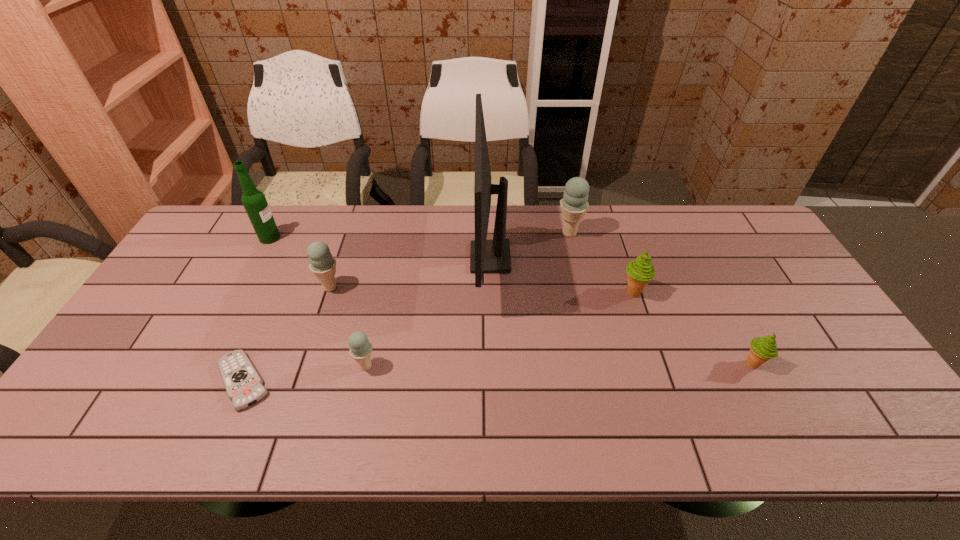
The height and width of the screenshot is (540, 960). Identify the location of free spot that satisfies the following two spatial constraints: 1. on the back side of the rightmost object; 2. on the right side of the second blue ice cream from left to right. (367, 364).

Locate an element on the screen. The width and height of the screenshot is (960, 540). vacant space that satisfies the following two spatial constraints: 1. on the label of the green beer bottle; 2. on the right side of the left green icecream is located at coordinates (241, 293).

Identify the location of vacant space that satisfies the following two spatial constraints: 1. on the front-facing side of the nearer green icecream; 2. on the left side of the fifth object from left to right. (492, 364).

Where is `blank space that satisfies the following two spatial constraints: 1. on the label of the beer bottle; 2. on the back side of the seventh object from left to right`? The height and width of the screenshot is (540, 960). blank space that satisfies the following two spatial constraints: 1. on the label of the beer bottle; 2. on the back side of the seventh object from left to right is located at coordinates (241, 293).

At what (x,y) coordinates should I click in order to perform the action: click on free spot that satisfies the following two spatial constraints: 1. on the back side of the seventh object from right to left; 2. on the label of the seventh shortest object. Please return your answer as a coordinate pair (x, y). Looking at the image, I should click on (305, 238).